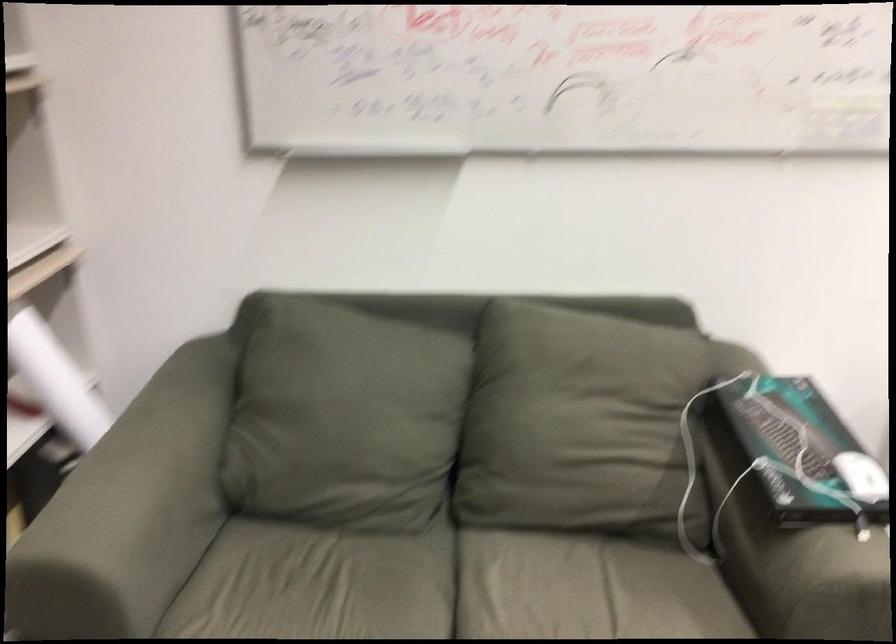
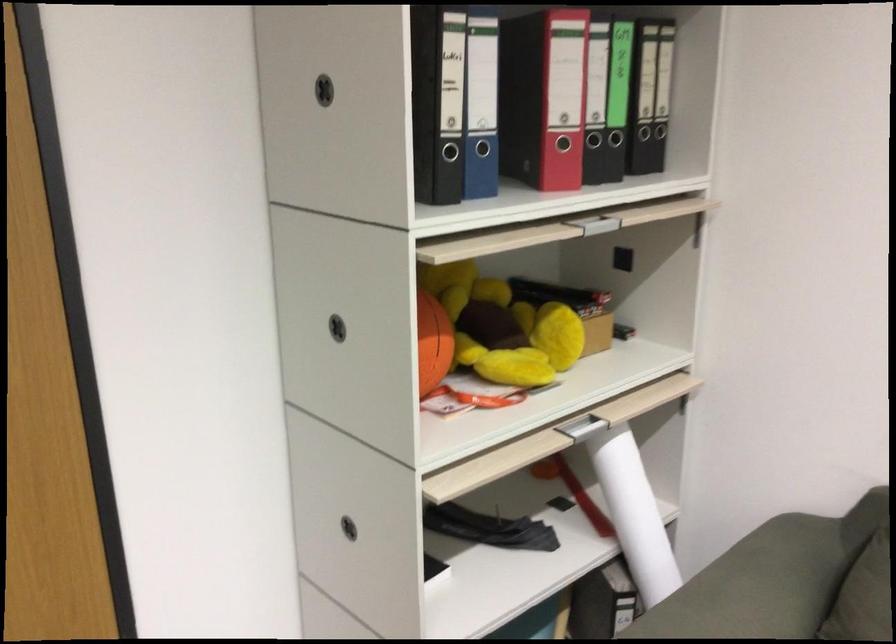
Where in the second image is the point corresponding to point (73, 386) from the first image?

(633, 514)